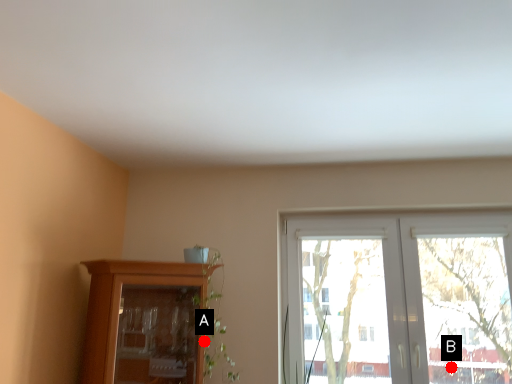
Question: Two points are circled on the image, labeled by A and B beside each circle. Which point is closer to the camera?

Choices:
 (A) A is closer
 (B) B is closer

Answer: (A)